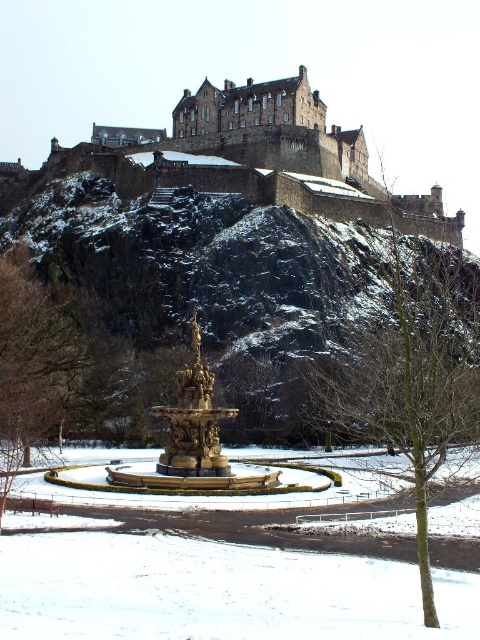
Consider the image. You are standing at the base of the grand stone castle and want to walk towards the large ornate fountain in the foreground. As you walk, you notice a specific location marked by point (215, 592). What object or feature does this point correspond to?

The point (215, 592) corresponds to the white powdery snow at lower center.